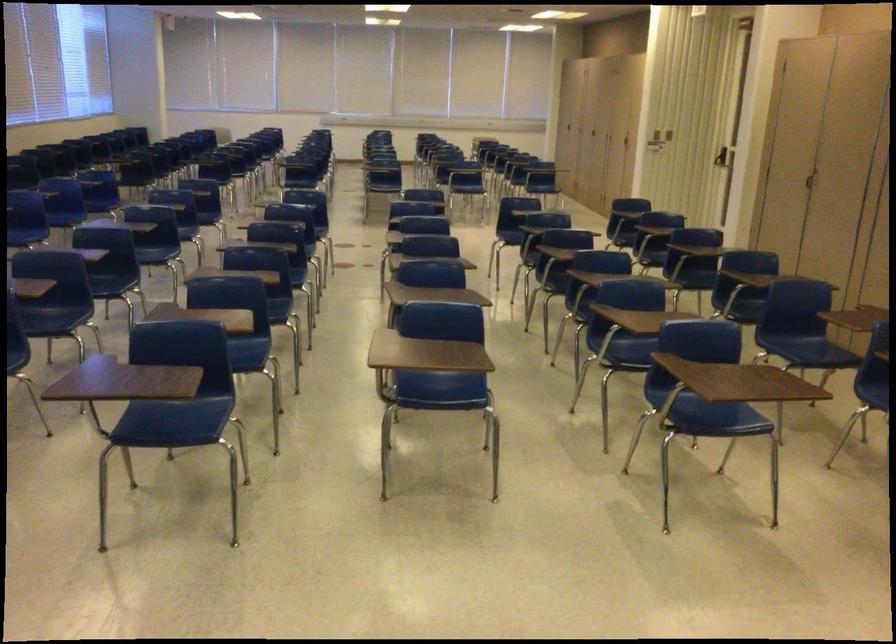
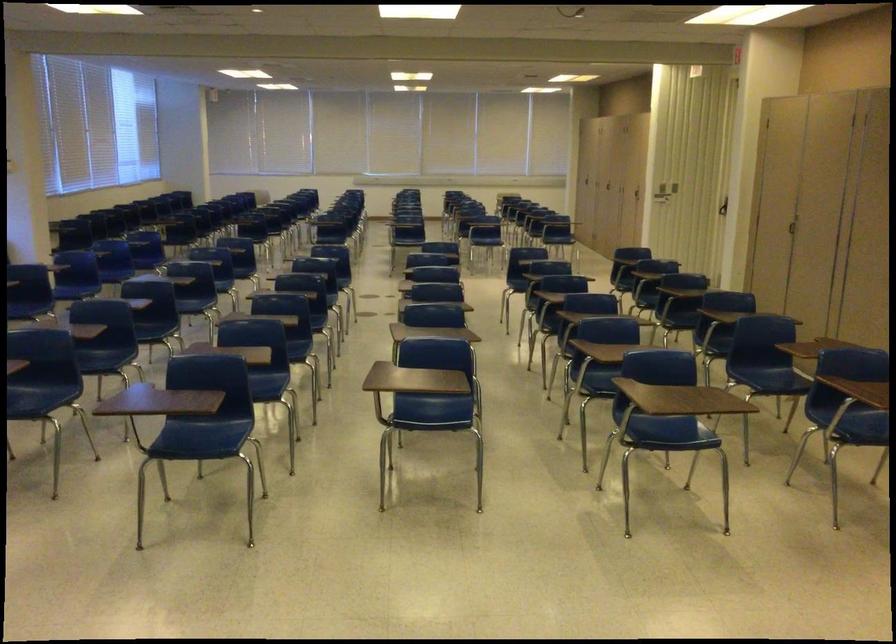
Locate, in the second image, the point that corresponds to (444,384) in the first image.

(435, 410)